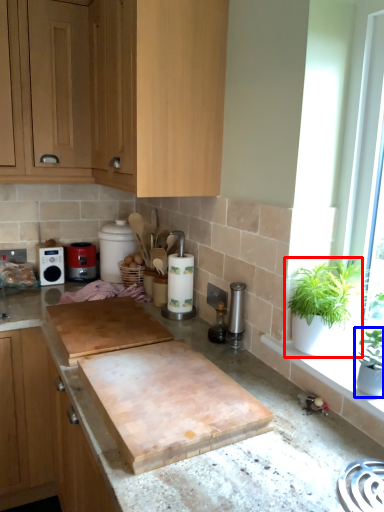
Question: Which object appears closest to the camera in this image, houseplant (highlighted by a red box) or houseplant (highlighted by a blue box)?

Choices:
 (A) houseplant
 (B) houseplant

Answer: (B)